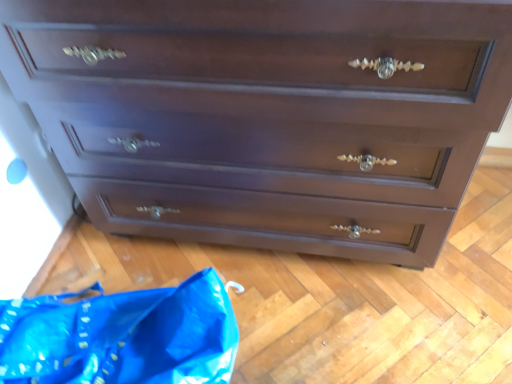
What do you see at coordinates (122, 336) in the screenshot? I see `blue plastic bag at lower left` at bounding box center [122, 336].

At what (x,y) coordinates should I click in order to perform the action: click on blue plastic bag at lower left. Please return your answer as a coordinate pair (x, y). The width and height of the screenshot is (512, 384). Looking at the image, I should click on (122, 336).

At what (x,y) coordinates should I click in order to perform the action: click on dark wood chest of drawers at center. Please return your answer as a coordinate pair (x, y). Image resolution: width=512 pixels, height=384 pixels. Looking at the image, I should click on (267, 115).

Describe the element at coordinates (267, 115) in the screenshot. The height and width of the screenshot is (384, 512). I see `dark wood chest of drawers at center` at that location.

Find the location of a particular element. Image resolution: width=512 pixels, height=384 pixels. blue plastic bag at lower left is located at coordinates (122, 336).

Considering the positions of objects blue plastic bag at lower left and dark wood chest of drawers at center in the image provided, who is more to the right, blue plastic bag at lower left or dark wood chest of drawers at center?

dark wood chest of drawers at center.

In the image, is blue plastic bag at lower left positioned in front of or behind dark wood chest of drawers at center?

blue plastic bag at lower left is positioned farther from the viewer than dark wood chest of drawers at center.

Considering the positions of points (119, 358) and (90, 79), is point (119, 358) closer to camera compared to point (90, 79)?

No, (119, 358) is behind (90, 79).

From the image's perspective, which object appears higher, blue plastic bag at lower left or dark wood chest of drawers at center?

From the image's view, dark wood chest of drawers at center is above.

Looking at this image, from a real-world perspective, does blue plastic bag at lower left sit lower than dark wood chest of drawers at center?

Yes, from a real-world perspective, blue plastic bag at lower left is under dark wood chest of drawers at center.

From the picture: Which object is thinner, blue plastic bag at lower left or dark wood chest of drawers at center?

blue plastic bag at lower left.

Who is shorter, blue plastic bag at lower left or dark wood chest of drawers at center?

blue plastic bag at lower left.

Is blue plastic bag at lower left smaller than dark wood chest of drawers at center?

Yes, blue plastic bag at lower left is smaller than dark wood chest of drawers at center.

Is blue plastic bag at lower left located outside dark wood chest of drawers at center?

blue plastic bag at lower left is positioned outside dark wood chest of drawers at center.

Can you see blue plastic bag at lower left touching dark wood chest of drawers at center?

No, blue plastic bag at lower left is not next to dark wood chest of drawers at center.

Is blue plastic bag at lower left positioned with its back to dark wood chest of drawers at center?

Correct, blue plastic bag at lower left is looking away from dark wood chest of drawers at center.

The width and height of the screenshot is (512, 384). I want to click on material that is on the left side of dark wood chest of drawers at center, so click(x=122, y=336).

Considering the relative positions of dark wood chest of drawers at center and blue plastic bag at lower left in the image provided, is dark wood chest of drawers at center to the right of blue plastic bag at lower left from the viewer's perspective?

Correct, you'll find dark wood chest of drawers at center to the right of blue plastic bag at lower left.

Is dark wood chest of drawers at center in front of or behind blue plastic bag at lower left in the image?

dark wood chest of drawers at center is positioned closer to the viewer than blue plastic bag at lower left.

Considering the points (444, 31) and (4, 362), which point is in front, point (444, 31) or point (4, 362)?

Point (444, 31)

From the image's perspective, does dark wood chest of drawers at center appear lower than blue plastic bag at lower left?

No.

From a real-world perspective, between dark wood chest of drawers at center and blue plastic bag at lower left, who is vertically higher?

dark wood chest of drawers at center.

Is dark wood chest of drawers at center wider than blue plastic bag at lower left?

Indeed, dark wood chest of drawers at center has a greater width compared to blue plastic bag at lower left.

Who is taller, dark wood chest of drawers at center or blue plastic bag at lower left?

With more height is dark wood chest of drawers at center.

Which of these two, dark wood chest of drawers at center or blue plastic bag at lower left, is bigger?

dark wood chest of drawers at center.

Is blue plastic bag at lower left located within dark wood chest of drawers at center?

No, blue plastic bag at lower left is not surrounded by dark wood chest of drawers at center.

Is the surface of dark wood chest of drawers at center in direct contact with blue plastic bag at lower left?

dark wood chest of drawers at center and blue plastic bag at lower left are clearly separated.

Could you tell me if dark wood chest of drawers at center is facing blue plastic bag at lower left?

Yes, dark wood chest of drawers at center is facing blue plastic bag at lower left.

Locate an element on the screen. This screenshot has width=512, height=384. material on the left of dark wood chest of drawers at center is located at coordinates (122, 336).

Where is `material that is on the left side of dark wood chest of drawers at center`? The height and width of the screenshot is (384, 512). material that is on the left side of dark wood chest of drawers at center is located at coordinates (122, 336).

Where is `material behind the dark wood chest of drawers at center`? material behind the dark wood chest of drawers at center is located at coordinates (122, 336).